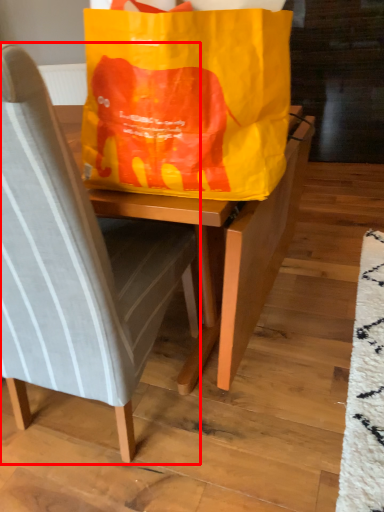
Question: From the image's perspective, considering the relative positions of chair (annotated by the red box) and grocery bag in the image provided, where is chair (annotated by the red box) located with respect to the staircase?

Choices:
 (A) below
 (B) above

Answer: (A)